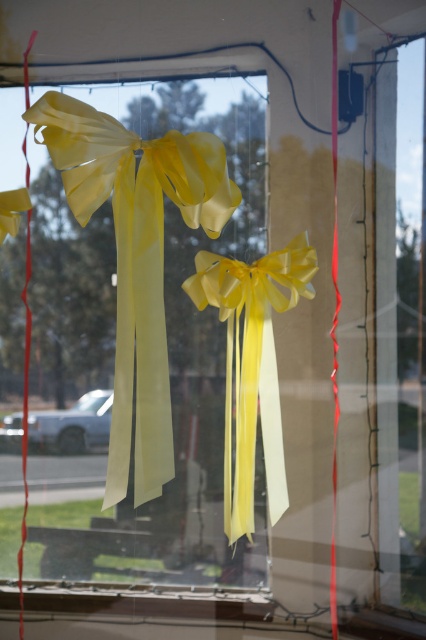
Question: Which object appears closest to the camera in this image?

Choices:
 (A) yellow satin ribbon at center
 (B) transparent plastic ribbon at right

Answer: (A)

Question: Which of the following is the closest to the observer?

Choices:
 (A) [x=399, y=262]
 (B) [x=120, y=371]
 (C) [x=253, y=376]

Answer: (B)

Question: Is translucent yellow ribbon at center below transparent plastic ribbon at right?

Choices:
 (A) yes
 (B) no

Answer: (B)

Question: From the image, what is the correct spatial relationship of transparent plastic ribbon at right in relation to yellow satin ribbon at center?

Choices:
 (A) above
 (B) below

Answer: (A)

Question: Is translucent yellow ribbon at center wider than transparent plastic ribbon at right?

Choices:
 (A) no
 (B) yes

Answer: (B)

Question: Which is farther from the yellow satin ribbon at center?

Choices:
 (A) translucent yellow ribbon at center
 (B) transparent plastic ribbon at right

Answer: (B)